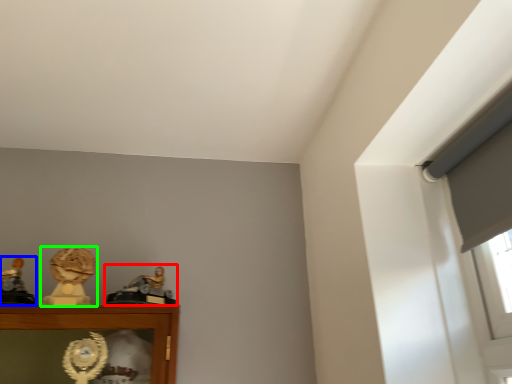
Question: Estimate the real-world distances between objects in this image. Which object is farther from character sculpture (highlighted by a red box), character sculpture (highlighted by a blue box) or character sculpture (highlighted by a green box)?

Choices:
 (A) character sculpture
 (B) character sculpture

Answer: (A)